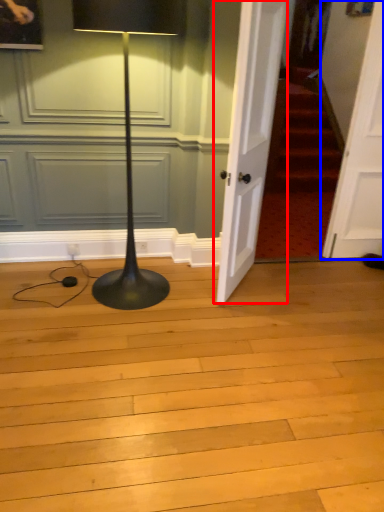
Question: Which of the following is the farthest to the observer, door (highlighted by a red box) or door (highlighted by a blue box)?

Choices:
 (A) door
 (B) door

Answer: (B)